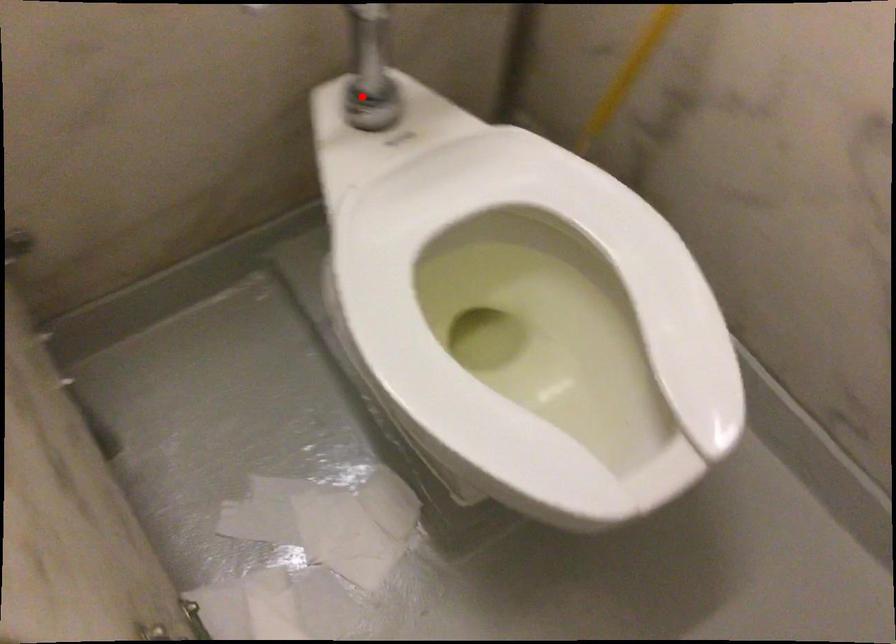
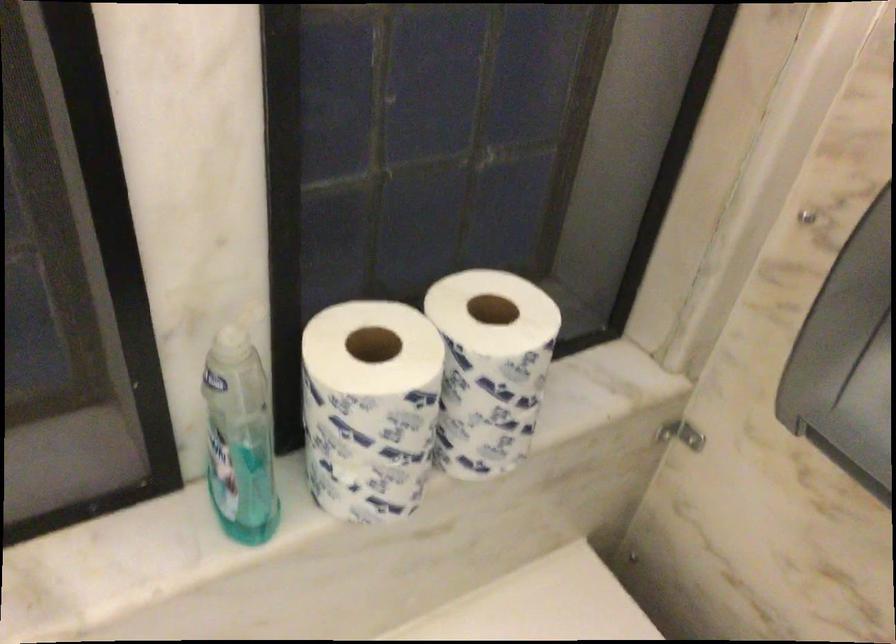
Question: I am providing you with two images of the same scene from different viewpoints. A red point is marked on the first image. Can you still see the location of the red point in image 2?

Choices:
 (A) Yes
 (B) No

Answer: (B)